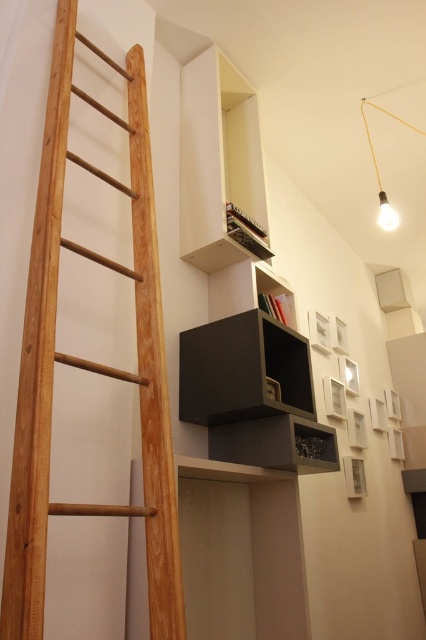
Can you confirm if white matte shelf at upper center is shorter than matte black shelf at center?

Incorrect, white matte shelf at upper center's height does not fall short of matte black shelf at center's.

You are a GUI agent. You are given a task and a screenshot of the screen. Output one action in this format:
    pyautogui.click(x=<x>, y=<y>)
    Task: Click on the white matte shelf at upper center
    
    Given the screenshot: What is the action you would take?
    pyautogui.click(x=216, y=160)

Is natural wood ladder at left taller than matte black shelf at center?

Yes.

Is the position of natural wood ladder at left more distant than that of matte black shelf at center?

No, it is in front of matte black shelf at center.

What are the coordinates of `natural wood ladder at left` in the screenshot? It's located at (89, 360).

Is matte black shelf at center wider than matte black shelf at upper center?

Yes.

Between point (319, 460) and point (281, 291), which one is positioned in front?

Point (319, 460) is more forward.

Where is `matte black shelf at center`? matte black shelf at center is located at coordinates (276, 444).